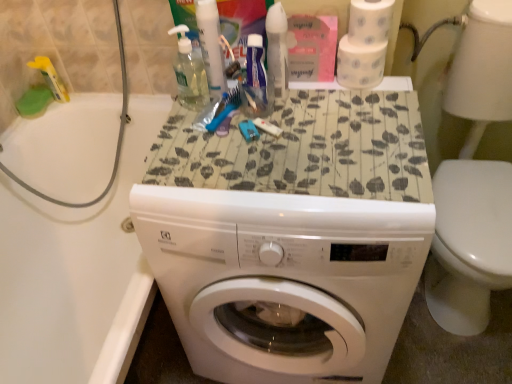
Question: Is white glossy washer at lower right beside white glossy bathtub at left?

Choices:
 (A) no
 (B) yes

Answer: (A)

Question: Is white glossy washer at lower right taller than white glossy bathtub at left?

Choices:
 (A) no
 (B) yes

Answer: (B)

Question: Is white glossy washer at lower right oriented towards white glossy bathtub at left?

Choices:
 (A) no
 (B) yes

Answer: (A)

Question: Can you confirm if white glossy washer at lower right is positioned to the right of white glossy bathtub at left?

Choices:
 (A) no
 (B) yes

Answer: (B)

Question: Could white glossy bathtub at left be considered to be inside white glossy washer at lower right?

Choices:
 (A) yes
 (B) no

Answer: (B)

Question: From a real-world perspective, relative to white glossy bathtub at left, is white textured toilet paper at upper right, which is counted as the 1th toilet paper, starting from the top, vertically above or below?

Choices:
 (A) below
 (B) above

Answer: (B)

Question: Looking at their shapes, would you say white textured toilet paper at upper right, which is counted as the 1th toilet paper, starting from the top, is wider or thinner than white glossy bathtub at left?

Choices:
 (A) wide
 (B) thin

Answer: (B)

Question: Based on their sizes in the image, would you say white textured toilet paper at upper right, the 2th toilet paper when ordered from bottom to top, is bigger or smaller than white glossy bathtub at left?

Choices:
 (A) big
 (B) small

Answer: (B)

Question: Which is correct: white textured toilet paper at upper right, which is counted as the 1th toilet paper, starting from the top, is inside white glossy bathtub at left, or outside of it?

Choices:
 (A) outside
 (B) inside

Answer: (A)

Question: In the image, is white textured toilet paper at upper right, the 2th toilet paper when ordered from bottom to top, positioned in front of or behind white textured toilet paper at upper right, the 2th toilet paper when ordered from top to bottom?

Choices:
 (A) behind
 (B) front

Answer: (B)

Question: From the image's perspective, is white textured toilet paper at upper right, the 2th toilet paper when ordered from bottom to top, positioned above or below white textured toilet paper at upper right, the 2th toilet paper when ordered from top to bottom?

Choices:
 (A) above
 (B) below

Answer: (A)

Question: Is white textured toilet paper at upper right, which is counted as the 1th toilet paper, starting from the top, situated inside white textured toilet paper at upper right, which is the first toilet paper from bottom to top, or outside?

Choices:
 (A) inside
 (B) outside

Answer: (B)

Question: From a real-world perspective, is white textured toilet paper at upper right, which is counted as the 1th toilet paper, starting from the top, physically located above or below white textured toilet paper at upper right, which is the first toilet paper from bottom to top?

Choices:
 (A) above
 (B) below

Answer: (A)

Question: Looking at the image, does white glossy bathtub at left seem bigger or smaller compared to translucent plastic spray bottle at upper center, marked as the 1th cleaning product in a right-to-left arrangement?

Choices:
 (A) big
 (B) small

Answer: (A)

Question: In terms of width, does white glossy bathtub at left look wider or thinner when compared to translucent plastic spray bottle at upper center, which is the second cleaning product from left to right?

Choices:
 (A) wide
 (B) thin

Answer: (A)